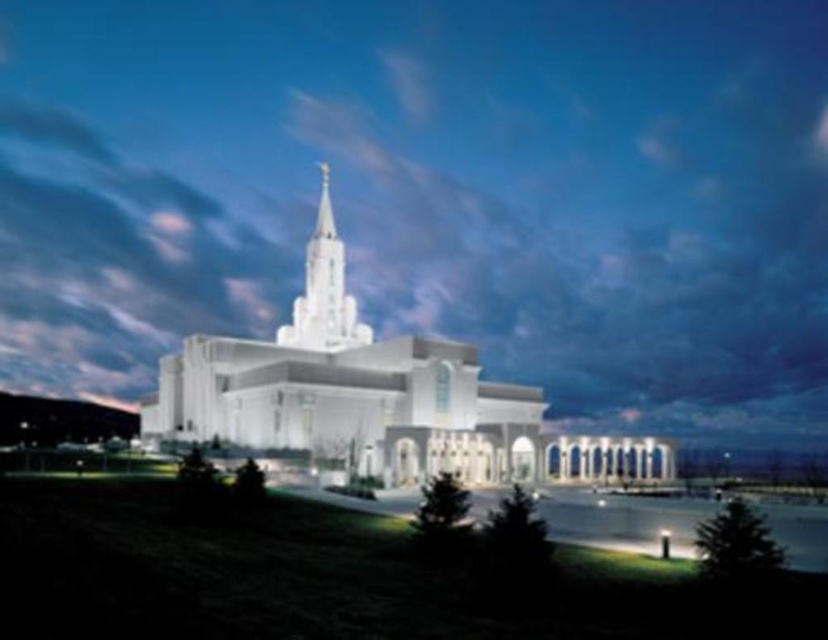
You are an architect analyzing the proportions of the white smooth church at center and the white stone spire at center in the image. Which structure has a larger size overall?

The white smooth church at center is bigger than the white stone spire at center, so the white smooth church at center has a larger size overall.